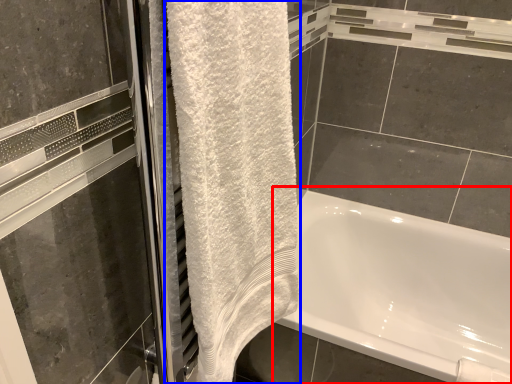
Question: Which object is further to the camera taking this photo, bathtub (highlighted by a red box) or towel (highlighted by a blue box)?

Choices:
 (A) bathtub
 (B) towel

Answer: (A)